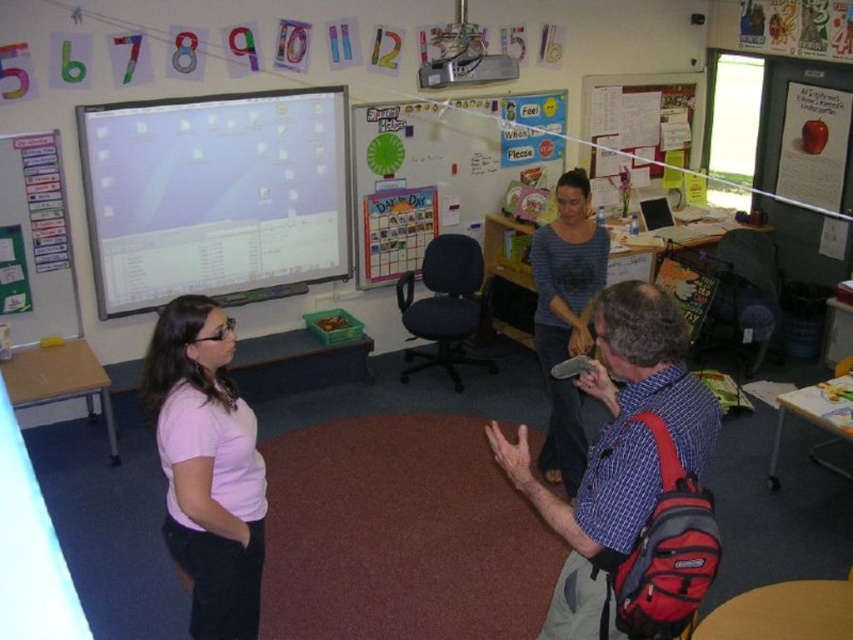
In the scene shown: Who is positioned more to the left, pink fabric shirt at left or blue striped sweater at center?

pink fabric shirt at left

Does pink fabric shirt at left appear on the right side of blue striped sweater at center?

In fact, pink fabric shirt at left is to the left of blue striped sweater at center.

Who is more distant from viewer, (178, 337) or (575, 353)?

Positioned behind is point (575, 353).

This screenshot has width=853, height=640. I want to click on pink fabric shirt at left, so click(207, 467).

Is plaid shirt at center above whiteboard at upper center?

No.

Between plaid shirt at center and whiteboard at upper center, which one has more height?

whiteboard at upper center is taller.

Is point (628, 301) farther from camera compared to point (438, 188)?

That is False.

You are a GUI agent. You are given a task and a screenshot of the screen. Output one action in this format:
    pyautogui.click(x=<x>, y=<y>)
    Task: Click on the plaid shirt at center
    This screenshot has height=640, width=853.
    Given the screenshot: What is the action you would take?
    pyautogui.click(x=618, y=451)

Does plaid shirt at center have a greater height compared to blue striped sweater at center?

Incorrect, plaid shirt at center's height is not larger of blue striped sweater at center's.

Which is in front, point (636, 445) or point (579, 412)?

Point (636, 445) is in front.

Is point (587, 630) farther from camera compared to point (558, 220)?

That is False.

Locate an element on the screen. This screenshot has height=640, width=853. plaid shirt at center is located at coordinates (618, 451).